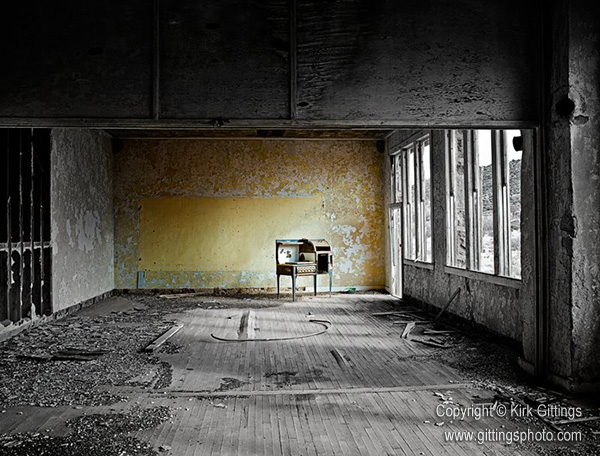
Locate an element on the screen. This screenshot has width=600, height=456. small debris piles on floor is located at coordinates (115, 341), (82, 386), (113, 438), (519, 396), (467, 356), (43, 378), (59, 322), (177, 306).